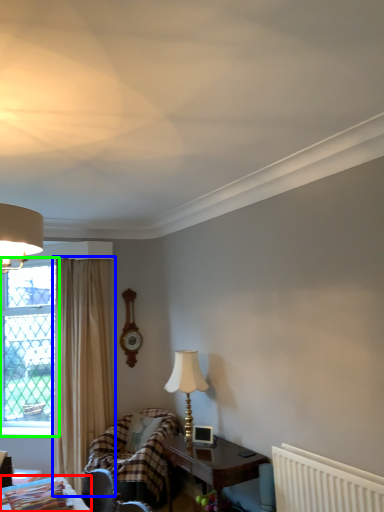
Question: Estimate the real-world distances between objects in this image. Which object is closer to table (highlighted by a red box), curtain (highlighted by a blue box) or window (highlighted by a green box)?

Choices:
 (A) curtain
 (B) window

Answer: (A)